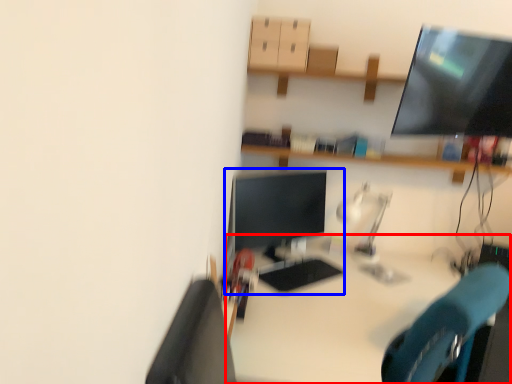
Question: Which object is closer to the camera taking this photo, desk (highlighted by a red box) or desktop computer (highlighted by a blue box)?

Choices:
 (A) desk
 (B) desktop computer

Answer: (A)